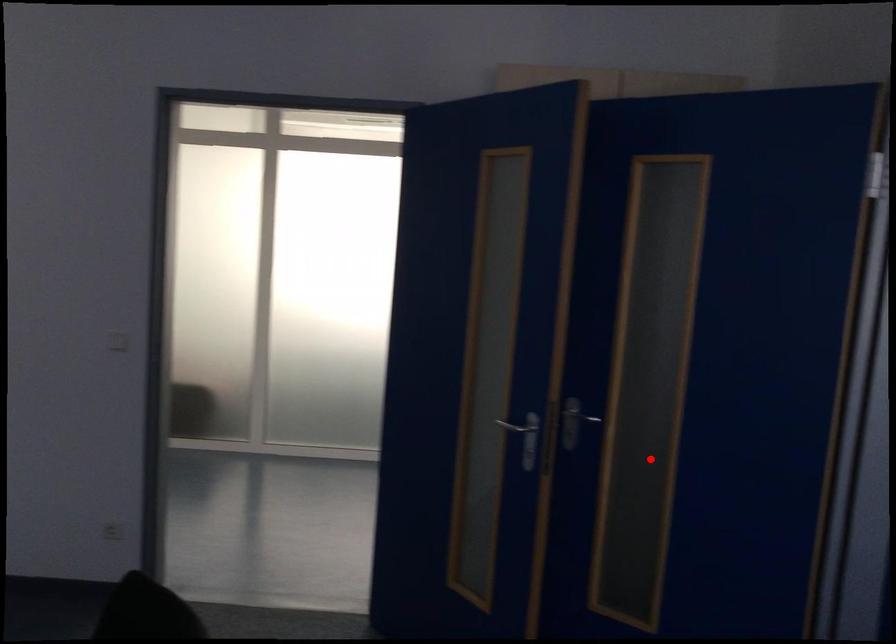
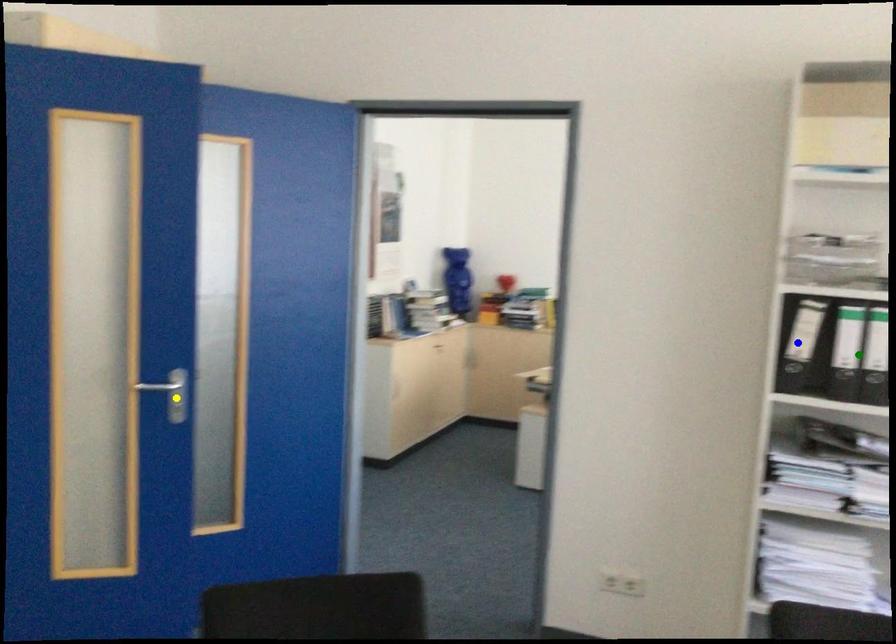
Question: I am providing you with two images of the same scene from different viewpoints. A red point is marked on the first image. You are given multiple points on the second image. Which point in image 2 is actually the same real-world point as the red point in image 1?

Choices:
 (A) green point
 (B) yellow point
 (C) blue point

Answer: (B)